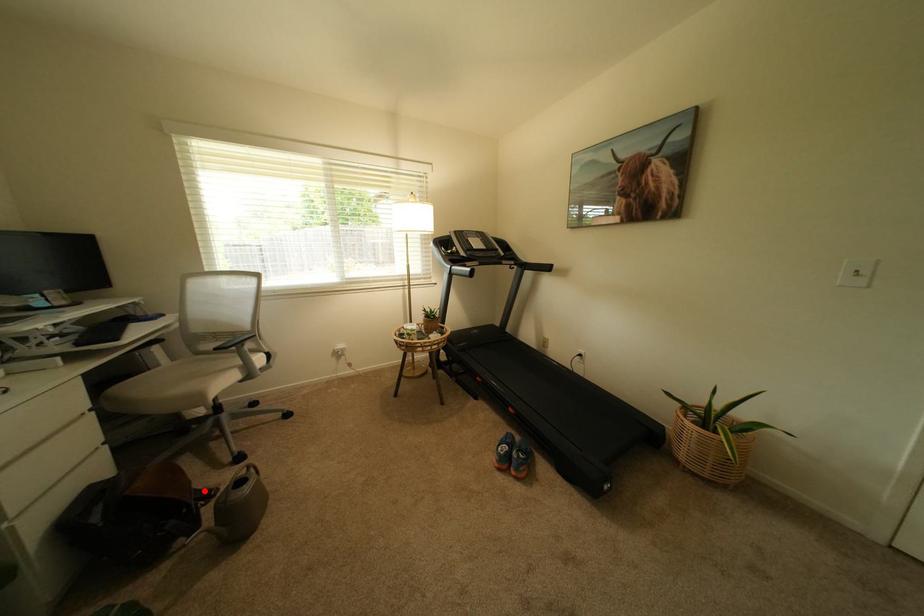
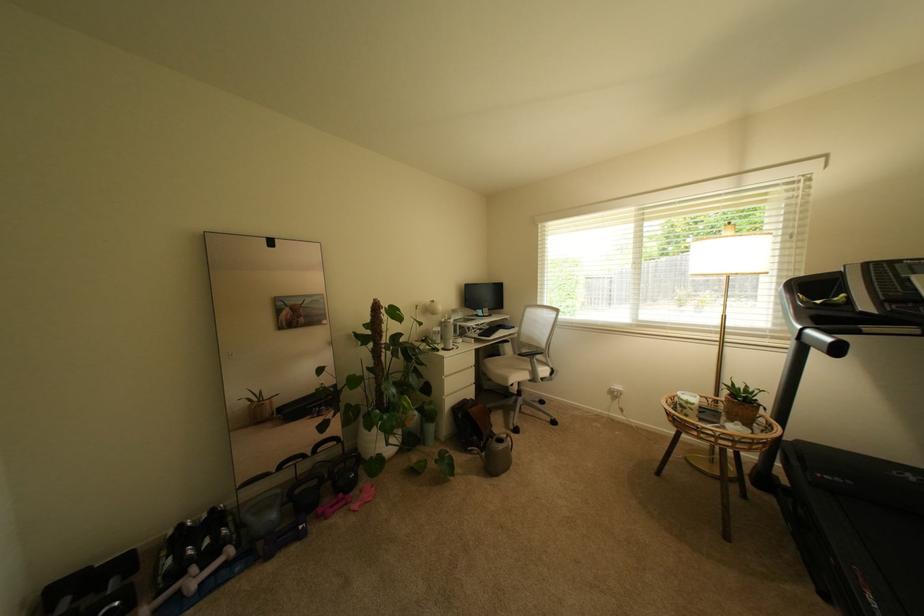
Question: I am providing you with two images of the same scene from different viewpoints. Given a red point in image1, look at the same physical point in image2. Is it:

Choices:
 (A) Closer to the viewpoint
 (B) Farther from the viewpoint

Answer: (B)